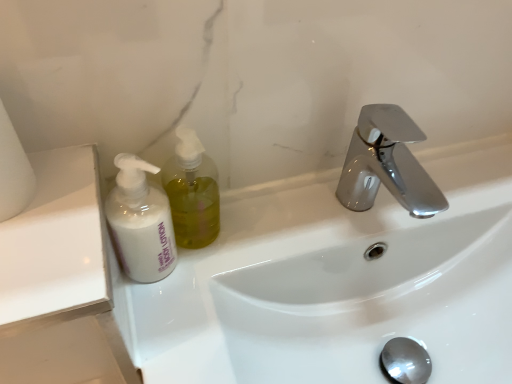
Question: Is white matte toilet paper at left taller or shorter than white matte lotion at left?

Choices:
 (A) short
 (B) tall

Answer: (A)

Question: Considering their positions, is white matte toilet paper at left located in front of or behind white matte lotion at left?

Choices:
 (A) behind
 (B) front

Answer: (B)

Question: Which object is the farthest from the white glossy sink at center?

Choices:
 (A) white matte lotion at left
 (B) translucent yellow liquid at left
 (C) white matte toilet paper at left

Answer: (C)

Question: Estimate the real-world distances between objects in this image. Which object is farther from the white matte lotion at left?

Choices:
 (A) white glossy sink at center
 (B) translucent yellow liquid at left
 (C) white matte toilet paper at left

Answer: (A)